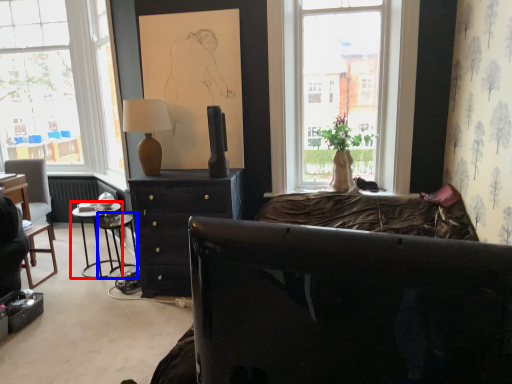
Question: Which object is further to the camera taking this photo, nightstand (highlighted by a red box) or bar stool (highlighted by a blue box)?

Choices:
 (A) nightstand
 (B) bar stool

Answer: (A)